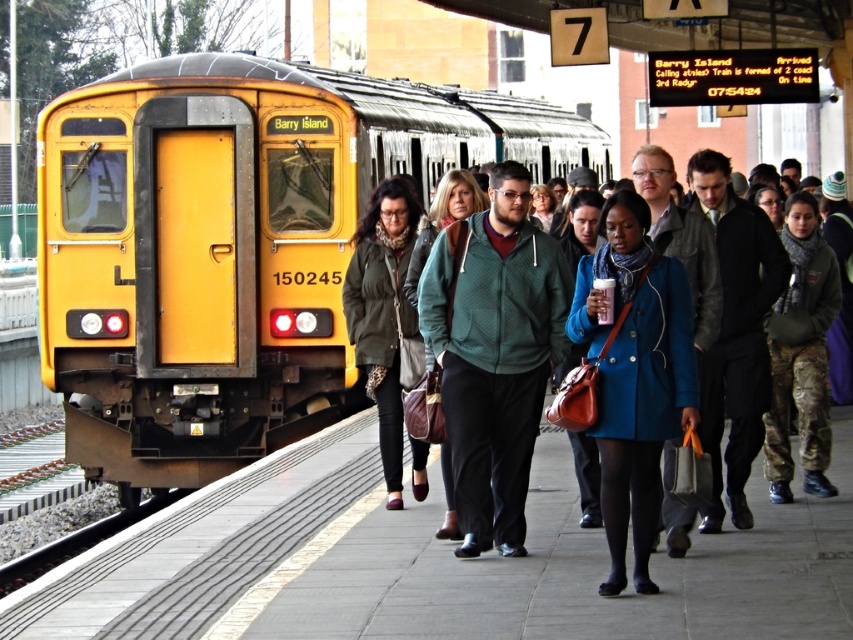
Question: Does green textured hoodie at center appear on the left side of green textured coat at center?

Choices:
 (A) yes
 (B) no

Answer: (B)

Question: Which object is positioned closest to the yellow matte train at left?

Choices:
 (A) matte blue coat at center
 (B) dark gray leather jacket at center
 (C) camouflage pants at center
 (D) green textured coat at center

Answer: (D)

Question: Which of the following is the farthest from the observer?

Choices:
 (A) yellow matte train at left
 (B) dark gray leather jacket at center
 (C) green textured hoodie at center

Answer: (A)

Question: Can you confirm if yellow matte train at left is thinner than green textured coat at center?

Choices:
 (A) no
 (B) yes

Answer: (A)

Question: Is dark gray leather jacket at center positioned at the back of camouflage pants at center?

Choices:
 (A) no
 (B) yes

Answer: (A)

Question: Which object is the closest to the yellow matte train at left?

Choices:
 (A) green textured coat at center
 (B) camouflage pants at center
 (C) dark gray leather jacket at center
 (D) matte blue coat at center

Answer: (A)